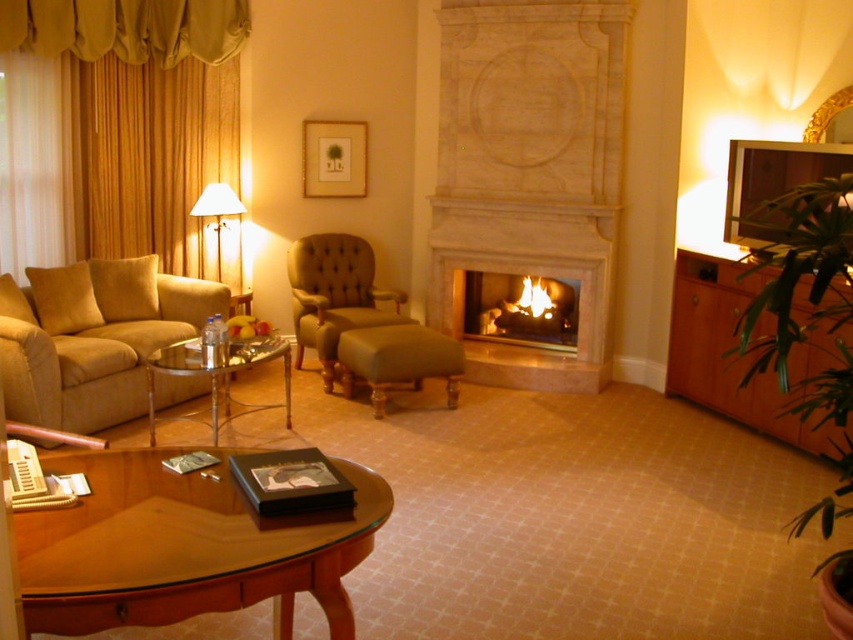
Question: Among these points, which one is farthest from the camera?

Choices:
 (A) (465, 273)
 (B) (450, 36)
 (C) (335, 515)

Answer: (A)

Question: Among these points, which one is farthest from the camera?

Choices:
 (A) (306, 269)
 (B) (6, 380)

Answer: (A)

Question: Can you confirm if gold fabric curtain at left is positioned below gold fabric curtain at upper left?

Choices:
 (A) yes
 (B) no

Answer: (A)

Question: Is gold fabric curtain at upper left thinner than metallic glass side table at center?

Choices:
 (A) no
 (B) yes

Answer: (A)

Question: Is white marble fireplace at center above matte wood picture frame at upper center?

Choices:
 (A) no
 (B) yes

Answer: (A)

Question: Which point is farther to the camera?

Choices:
 (A) matte gold lamp at upper left
 (B) matte wood picture frame at upper center
 (C) gold fabric curtain at upper left

Answer: (B)